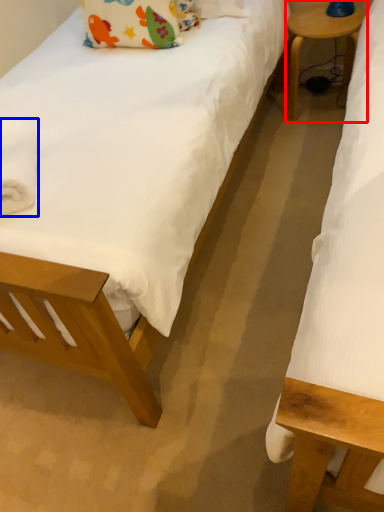
Question: Among these objects, which one is farthest to the camera, table (highlighted by a red box) or material (highlighted by a blue box)?

Choices:
 (A) table
 (B) material

Answer: (A)